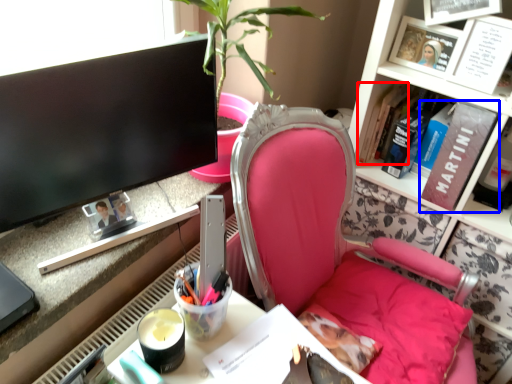
Question: Which object is further to the camera taking this photo, book (highlighted by a red box) or book (highlighted by a blue box)?

Choices:
 (A) book
 (B) book

Answer: (A)